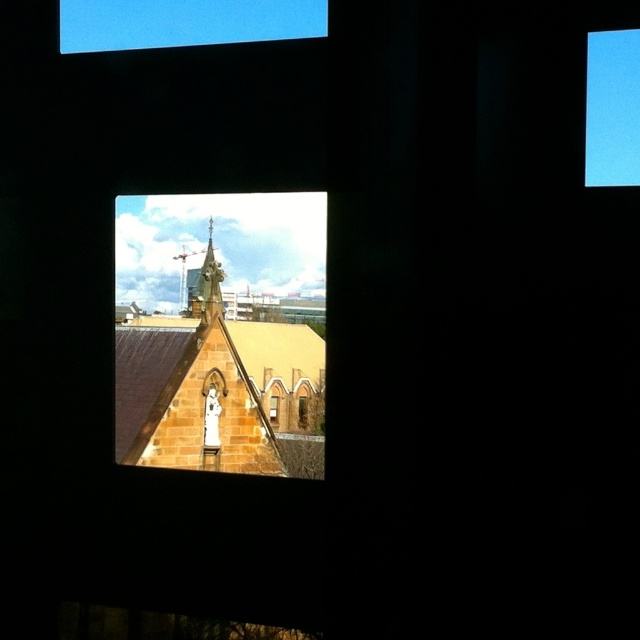
Question: Which of the following is the closest to the observer?

Choices:
 (A) gold textured spire at center
 (B) transparent glass window at lower center
 (C) blue glass window at upper right

Answer: (C)

Question: Does blue glass window at upper right appear over transparent glass window at lower center?

Choices:
 (A) no
 (B) yes

Answer: (B)

Question: Considering the real-world distances, which object is closest to the transparent glass window at lower center?

Choices:
 (A) gold textured spire at center
 (B) clear glass window at center
 (C) blue glass window at upper right

Answer: (B)

Question: Which point is farther from the camera taking this photo?

Choices:
 (A) (602, 108)
 (B) (220, 376)
 (C) (209, 276)
 (D) (301, 412)

Answer: (D)

Question: Does blue glass window at upper right appear under clear glass window at center?

Choices:
 (A) yes
 (B) no

Answer: (B)

Question: Does gold textured spire at center appear on the right side of transparent glass window at lower center?

Choices:
 (A) yes
 (B) no

Answer: (B)